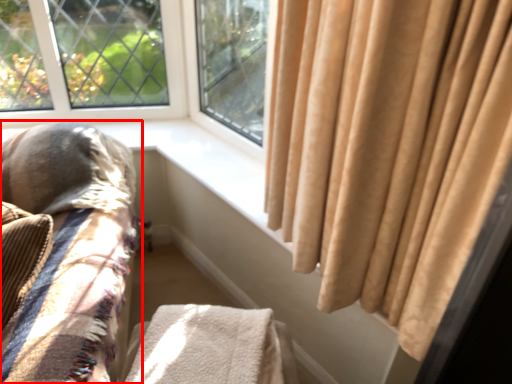
Question: Observing the image, what is the correct spatial positioning of furniture (annotated by the red box) in reference to blanket?

Choices:
 (A) left
 (B) right

Answer: (A)